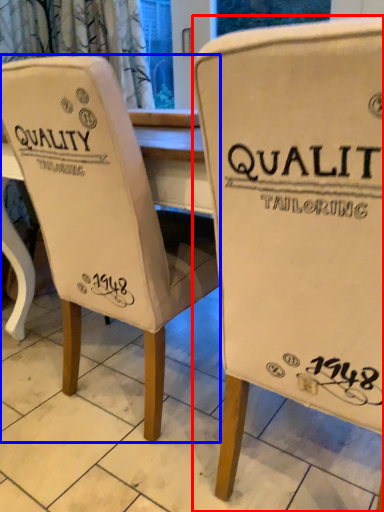
Question: Which of the following is the closest to the observer, chair (highlighted by a red box) or chair (highlighted by a blue box)?

Choices:
 (A) chair
 (B) chair

Answer: (A)